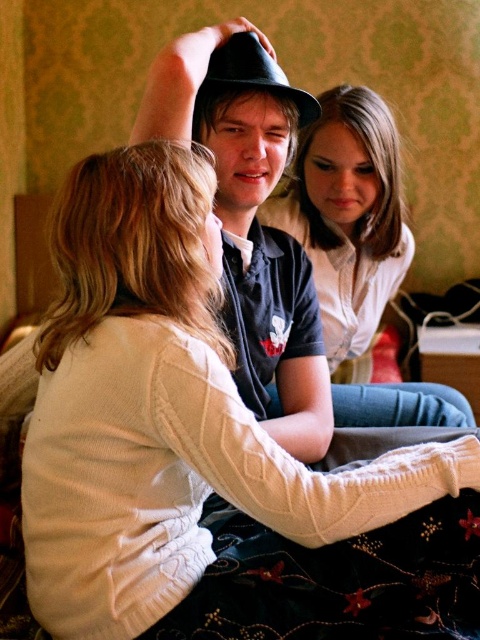
Question: Is smooth white shirt at center closer to the viewer compared to matte black hat at center?

Choices:
 (A) yes
 (B) no

Answer: (B)

Question: Is smooth white shirt at center below matte black hat at center?

Choices:
 (A) no
 (B) yes

Answer: (B)

Question: Which object is closer to the camera taking this photo?

Choices:
 (A) matte black hat at center
 (B) smooth white shirt at center

Answer: (A)

Question: Which of the following is the closest to the observer?

Choices:
 (A) smooth white shirt at center
 (B) matte black hat at center

Answer: (B)

Question: Can you confirm if smooth white shirt at center is wider than matte black hat at center?

Choices:
 (A) no
 (B) yes

Answer: (B)